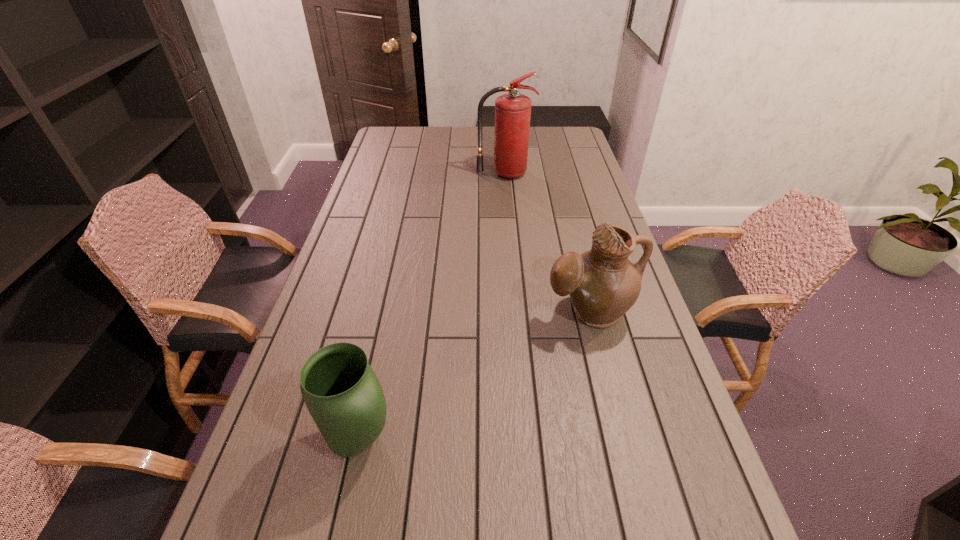
Find the location of a particular element. The image size is (960, 540). the tallest object is located at coordinates (513, 110).

Where is `the farthest object`? The width and height of the screenshot is (960, 540). the farthest object is located at coordinates (513, 110).

Image resolution: width=960 pixels, height=540 pixels. Identify the location of the second farthest object. (603, 284).

The width and height of the screenshot is (960, 540). What are the coordinates of `the shortest object` in the screenshot? It's located at (342, 393).

Identify the location of vase. (342, 393).

The height and width of the screenshot is (540, 960). What are the coordinates of `vacant space situated 0.110m at the front of the tallest object where the nozzle is aimed` in the screenshot? It's located at click(506, 196).

Where is `vacant area located 0.340m at the spout of the pitcher`? The width and height of the screenshot is (960, 540). vacant area located 0.340m at the spout of the pitcher is located at coordinates (629, 467).

You are a GUI agent. You are given a task and a screenshot of the screen. Output one action in this format:
    pyautogui.click(x=<x>, y=<y>)
    Task: Click on the vacant space situated 0.110m on the left of the shortest object
    The width and height of the screenshot is (960, 540).
    Given the screenshot: What is the action you would take?
    [269, 440]

Image resolution: width=960 pixels, height=540 pixels. Identify the location of object located at the left edge. (342, 393).

Locate an element on the screen. object positioned at the right edge is located at coordinates (603, 284).